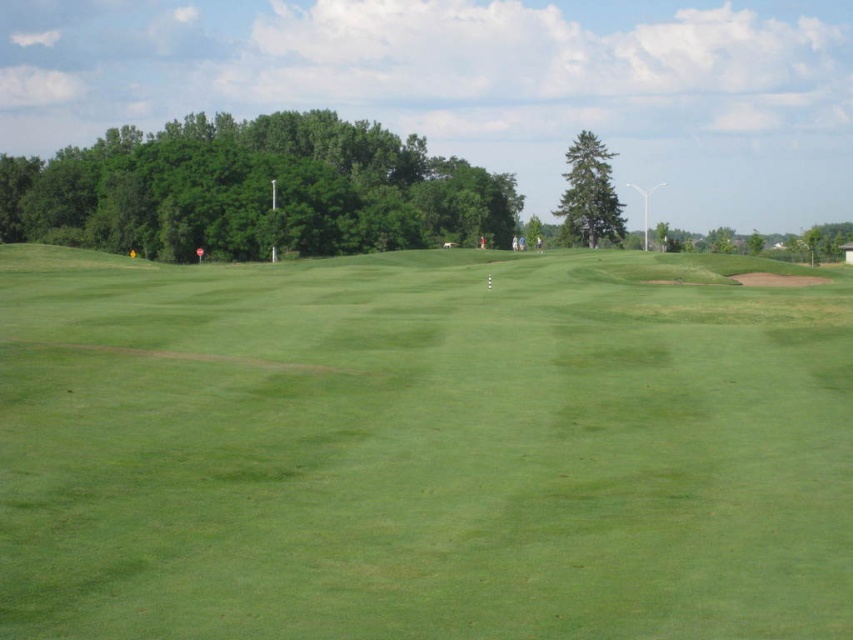
Is point (686, 419) positioned before point (612, 184)?

That is True.

Does point (277, 326) come in front of point (593, 236)?

Yes.

The image size is (853, 640). In order to click on green grassy field at center in this screenshot , I will do `click(422, 449)`.

Can you confirm if green leafy tree at upper left is wider than green textured tree at center?

Correct, the width of green leafy tree at upper left exceeds that of green textured tree at center.

Describe the element at coordinates (254, 189) in the screenshot. I see `green leafy tree at upper left` at that location.

You are a GUI agent. You are given a task and a screenshot of the screen. Output one action in this format:
    pyautogui.click(x=<x>, y=<y>)
    Task: Click on the green leafy tree at upper left
    
    Given the screenshot: What is the action you would take?
    pyautogui.click(x=254, y=189)

Does point (618, 317) lie in front of point (311, 195)?

That is True.

Who is positioned more to the right, green grassy field at center or green leafy tree at upper left?

green grassy field at center

Is point (285, 324) positioned behind point (181, 224)?

No, (285, 324) is in front of (181, 224).

Find the location of `green grassy field at center`. green grassy field at center is located at coordinates (422, 449).